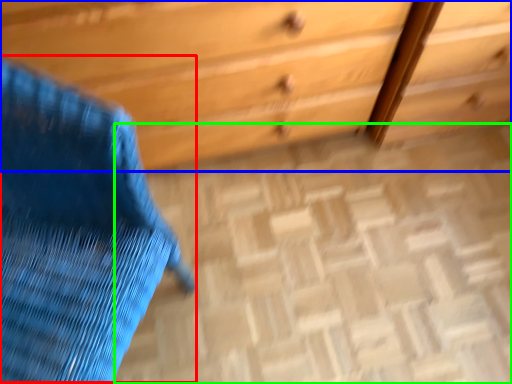
Question: Estimate the real-world distances between objects in this image. Which object is farther from swivel chair (highlighted by a red box), chest of drawers (highlighted by a blue box) or plain (highlighted by a green box)?

Choices:
 (A) chest of drawers
 (B) plain

Answer: (B)